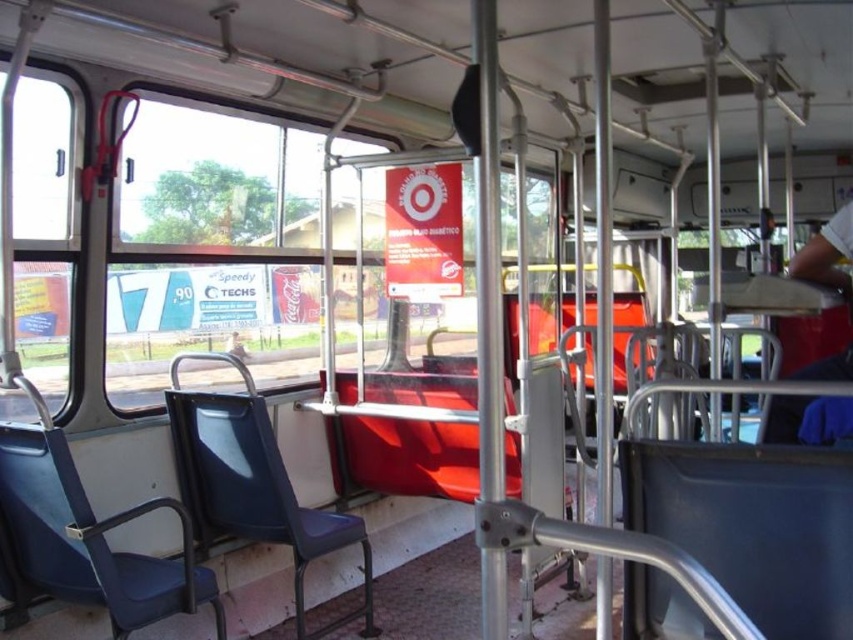
Can you confirm if transparent glass window at center is positioned above white fabric shirt at right?

Yes, transparent glass window at center is above white fabric shirt at right.

Between transparent glass window at center and white fabric shirt at right, which one appears on the left side from the viewer's perspective?

transparent glass window at center

The height and width of the screenshot is (640, 853). Identify the location of transparent glass window at center. (212, 244).

Who is positioned more to the right, transparent glass window at center or blue plastic chair at lower right?

blue plastic chair at lower right is more to the right.

Is transparent glass window at center in front of blue plastic chair at lower right?

No, transparent glass window at center is behind blue plastic chair at lower right.

The width and height of the screenshot is (853, 640). I want to click on transparent glass window at center, so click(x=212, y=244).

Is blue plastic chair at lower right thinner than blue fabric chair at left?

Indeed, blue plastic chair at lower right has a lesser width compared to blue fabric chair at left.

Between blue plastic chair at lower right and blue fabric chair at left, which one has less height?

With less height is blue plastic chair at lower right.

Locate an element on the screen. The width and height of the screenshot is (853, 640). blue plastic chair at lower right is located at coordinates (751, 515).

Where is `blue plastic chair at lower right`? The width and height of the screenshot is (853, 640). blue plastic chair at lower right is located at coordinates (751, 515).